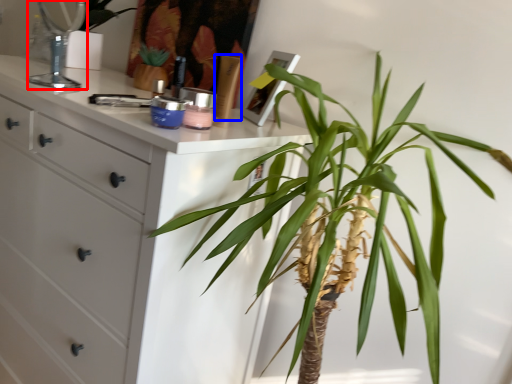
Question: Which object appears farthest to the camera in this image, mirror (highlighted by a red box) or toiletry (highlighted by a blue box)?

Choices:
 (A) mirror
 (B) toiletry

Answer: (A)